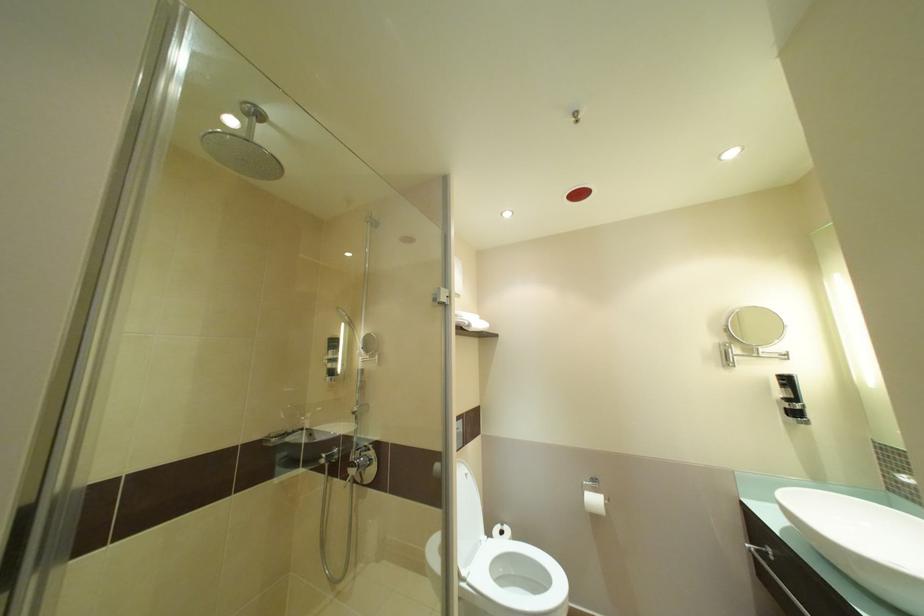
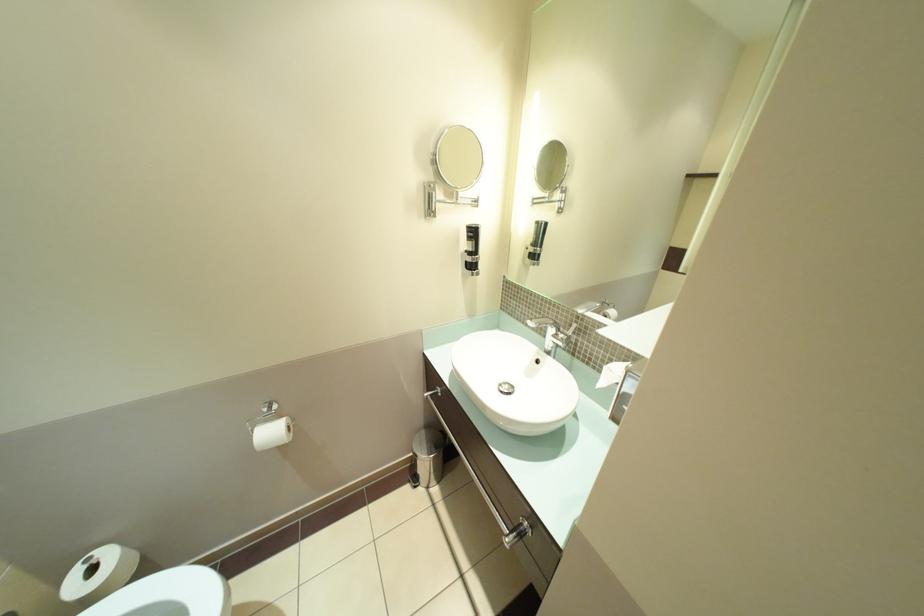
The images are taken continuously from a first-person perspective. In which direction is your viewpoint rotating?

The rotation direction of the camera is right-down.